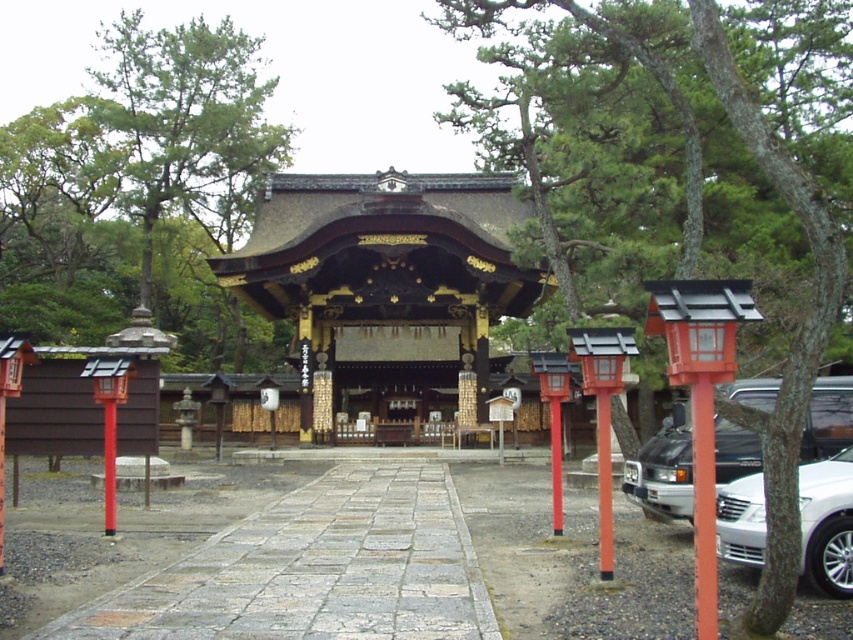
You are a visitor at the shrine and want to take a photo of both point [137,97] and point [821,397] in the same frame. Which point should you position closer to the camera to ensure both are visible?

To include both points in the same frame, position point [821,397] closer to the camera since point [137,97] is behind it. This way, the foreground point will be in focus while the background point remains visible.

You are a visitor at the shrine and want to take a photo of the green leafy tree at upper left without the metallic silver van at lower right blocking the view. Based on their positions, is this possible?

The green leafy tree at upper left is positioned over the metallic silver van at lower right, so the van is directly below the tree. To avoid the van blocking the view, you could angle your camera upwards to capture the tree while avoiding the van below.

You are a visitor at the shrine and want to compare the two posts. Which one is taller between the smooth orange post at center and the smooth red pole at left?

The smooth orange post at center is taller than the smooth red pole at left.